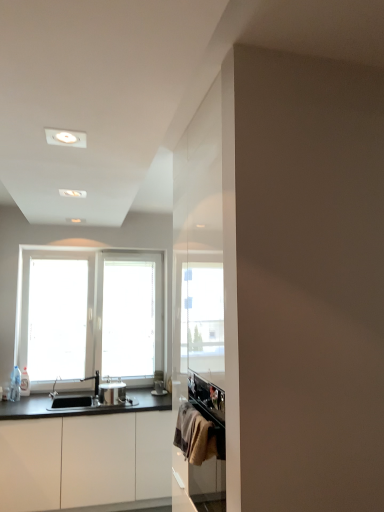
Where is `clear glass bottle at left`? This screenshot has width=384, height=512. clear glass bottle at left is located at coordinates (15, 384).

This screenshot has height=512, width=384. Describe the element at coordinates (198, 436) in the screenshot. I see `textured beige towel at lower right` at that location.

What do you see at coordinates (112, 392) in the screenshot?
I see `satin silver pot at center, which is the first appliance in front-to-back order` at bounding box center [112, 392].

This screenshot has width=384, height=512. Identify the location of metallic silver toaster at center, the second appliance positioned from the left. point(159,384).

Is point (16, 379) closer or farther from the camera than point (8, 499)?

Clearly, point (16, 379) is more distant from the camera than point (8, 499).

Which is more to the right, clear glass bottle at left or white matte cabinet at lower left?

white matte cabinet at lower left.

From the image's perspective, is clear glass bottle at left under white matte cabinet at lower left?

No, from the image's perspective, clear glass bottle at left is not below white matte cabinet at lower left.

Which object is more forward, clear glass bottle at left or white matte cabinet at lower left?

white matte cabinet at lower left is in front.

Consider the image. Considering the sizes of white matte cabinet at lower left and metallic silver toaster at center, the first appliance from the back, in the image, is white matte cabinet at lower left wider or thinner than metallic silver toaster at center, the first appliance from the back,?

Clearly, white matte cabinet at lower left has more width compared to metallic silver toaster at center, the first appliance from the back.

Does white matte cabinet at lower left have a larger size compared to metallic silver toaster at center, marked as the first appliance in a right-to-left arrangement?

Indeed, white matte cabinet at lower left has a larger size compared to metallic silver toaster at center, marked as the first appliance in a right-to-left arrangement.

Does point (10, 448) appear closer or farther from the camera than point (156, 380)?

Point (10, 448) is closer to the camera than point (156, 380).

How many degrees apart are the facing directions of white matte cabinet at lower left and metallic silver toaster at center, positioned as the 2th appliance in front-to-back order?

The angle between the facing direction of white matte cabinet at lower left and the facing direction of metallic silver toaster at center, positioned as the 2th appliance in front-to-back order, is 0.774 degrees.

Can you confirm if white matte cabinet at lower left is shorter than satin silver pot at center, positioned as the second appliance in right-to-left order?

No.

In the scene shown: From the image's perspective, which one is positioned lower, white matte cabinet at lower left or satin silver pot at center, which ranks as the 2th appliance in back-to-front order?

white matte cabinet at lower left, from the image's perspective.

Looking at this image, is textured beige towel at lower right bigger or smaller than metallic silver toaster at center, marked as the first appliance in a right-to-left arrangement?

Considering their sizes, textured beige towel at lower right takes up less space than metallic silver toaster at center, marked as the first appliance in a right-to-left arrangement.

Is textured beige towel at lower right closer to camera compared to metallic silver toaster at center, marked as the first appliance in a right-to-left arrangement?

Yes, textured beige towel at lower right is in front of metallic silver toaster at center, marked as the first appliance in a right-to-left arrangement.

Does textured beige towel at lower right have a greater width compared to metallic silver toaster at center, positioned as the 2th appliance in front-to-back order?

No.

Would you say textured beige towel at lower right is a long distance from metallic silver toaster at center, marked as the first appliance in a right-to-left arrangement?

Yes.

Is textured beige towel at lower right bigger or smaller than satin silver pot at center, which ranks as the 2th appliance in back-to-front order?

In the image, textured beige towel at lower right appears to be smaller than satin silver pot at center, which ranks as the 2th appliance in back-to-front order.

Is textured beige towel at lower right facing away from satin silver pot at center, which is the first appliance in front-to-back order?

That's not correct — textured beige towel at lower right is not looking away from satin silver pot at center, which is the first appliance in front-to-back order.

Considering the positions of objects textured beige towel at lower right and satin silver pot at center, which ranks as the 2th appliance in back-to-front order, in the image provided, who is in front, textured beige towel at lower right or satin silver pot at center, which ranks as the 2th appliance in back-to-front order,?

textured beige towel at lower right is in front.

Are white matte cabinet at lower left and textured beige towel at lower right located far from each other?

Yes, white matte cabinet at lower left is far from textured beige towel at lower right.

In order to click on laundry lying on the right of white matte cabinet at lower left in this screenshot , I will do `click(198, 436)`.

Considering the relative sizes of white matte cabinet at lower left and textured beige towel at lower right in the image provided, is white matte cabinet at lower left thinner than textured beige towel at lower right?

In fact, white matte cabinet at lower left might be wider than textured beige towel at lower right.

Does point (73, 464) appear closer or farther from the camera than point (223, 438)?

Clearly, point (73, 464) is more distant from the camera than point (223, 438).

Considering the relative sizes of metallic silver toaster at center, the first appliance from the back, and satin silver pot at center, positioned as the 1th appliance in left-to-right order, in the image provided, is metallic silver toaster at center, the first appliance from the back, thinner than satin silver pot at center, positioned as the 1th appliance in left-to-right order,?

Yes.

The image size is (384, 512). I want to click on appliance behind the satin silver pot at center, which is the first appliance in front-to-back order, so click(x=159, y=384).

Is metallic silver toaster at center, the second appliance positioned from the left, with satin silver pot at center, which ranks as the 2th appliance in back-to-front order?

metallic silver toaster at center, the second appliance positioned from the left, is not next to satin silver pot at center, which ranks as the 2th appliance in back-to-front order, and they're not touching.

This screenshot has width=384, height=512. Identify the location of cabinetry below the clear glass bottle at left (from the image's perspective). (84, 460).

The image size is (384, 512). In order to click on cabinetry on the left of metallic silver toaster at center, the second appliance positioned from the left in this screenshot , I will do point(84,460).

Estimate the real-world distances between objects in this image. Which object is closer to clear glass bottle at left, satin silver pot at center, positioned as the second appliance in right-to-left order, or metallic silver toaster at center, the second appliance positioned from the left?

The object closer to clear glass bottle at left is satin silver pot at center, positioned as the second appliance in right-to-left order.

From the picture: When comparing their distances from metallic silver toaster at center, positioned as the 2th appliance in front-to-back order, does clear glass bottle at left or white matte cabinet at lower left seem further?

clear glass bottle at left is further to metallic silver toaster at center, positioned as the 2th appliance in front-to-back order.

From the image, which object appears to be farther from satin nickel faucet at sink left, satin silver pot at center, positioned as the 1th appliance in left-to-right order, or metallic silver toaster at center, marked as the first appliance in a right-to-left arrangement?

The object further to satin nickel faucet at sink left is metallic silver toaster at center, marked as the first appliance in a right-to-left arrangement.

Considering their positions, is textured beige towel at lower right positioned closer to satin nickel faucet at sink left than satin silver pot at center, positioned as the 1th appliance in left-to-right order?

satin silver pot at center, positioned as the 1th appliance in left-to-right order, is closer to satin nickel faucet at sink left.

Based on their spatial positions, is textured beige towel at lower right or clear glass bottle at left closer to satin silver pot at center, positioned as the second appliance in right-to-left order?

clear glass bottle at left is closer to satin silver pot at center, positioned as the second appliance in right-to-left order.

Looking at the image, which one is located further to clear glass bottle at left, satin nickel faucet at sink left or white matte cabinet at lower left?

white matte cabinet at lower left lies further to clear glass bottle at left than the other object.

When comparing their distances from white matte cabinet at lower left, does textured beige towel at lower right or clear glass bottle at left seem further?

textured beige towel at lower right.

Based on their spatial positions, is clear glass bottle at left or satin nickel faucet at sink left closer to metallic silver toaster at center, positioned as the 2th appliance in front-to-back order?

Based on the image, satin nickel faucet at sink left appears to be nearer to metallic silver toaster at center, positioned as the 2th appliance in front-to-back order.

Identify the location of appliance located between white matte cabinet at lower left and metallic silver toaster at center, positioned as the 2th appliance in front-to-back order, in the depth direction. (112, 392).

Identify the location of cabinetry between clear glass bottle at left and satin silver pot at center, which is the first appliance in front-to-back order. (84, 460).

The width and height of the screenshot is (384, 512). I want to click on appliance between textured beige towel at lower right and clear glass bottle at left from front to back, so click(x=112, y=392).

Locate an element on the screen. Image resolution: width=384 pixels, height=512 pixels. faucet located between clear glass bottle at left and white matte cabinet at lower left in the left-right direction is located at coordinates (95, 381).